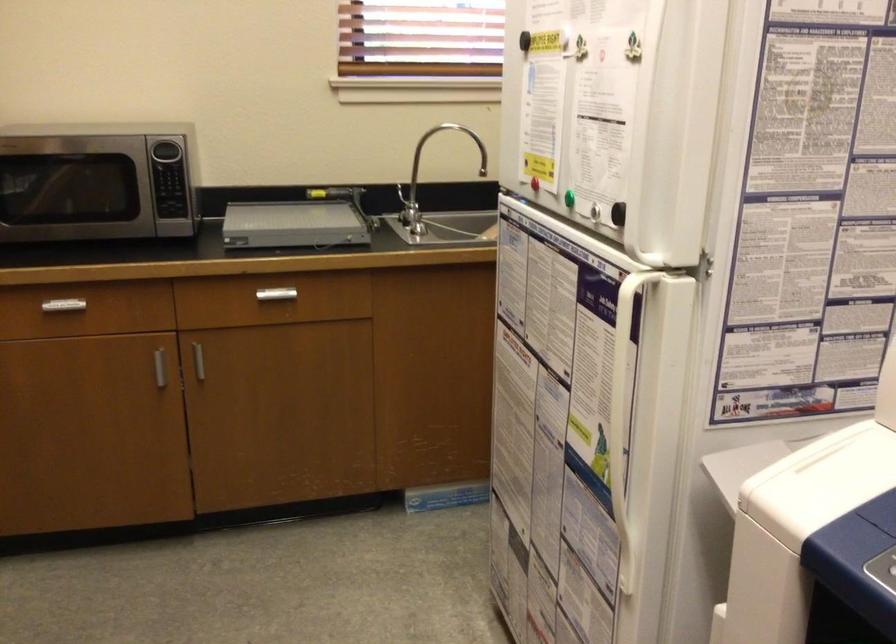
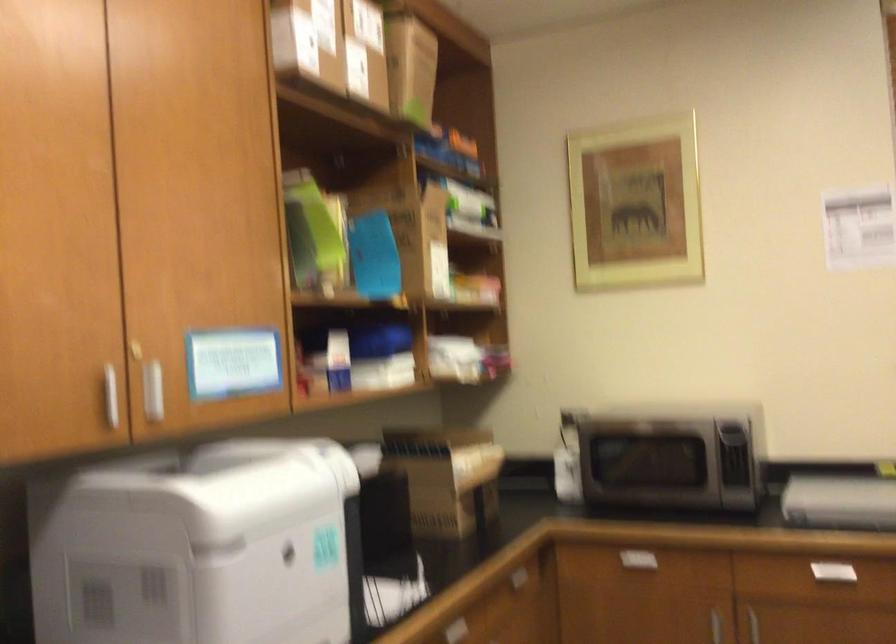
Locate, in the second image, the point that corresponds to pixel 300 305 in the first image.

(855, 579)